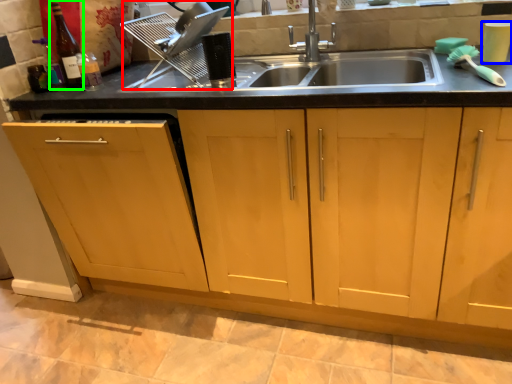
Question: Which object is the farthest from appliance (highlighted by a red box)? Choose among these: appliance (highlighted by a blue box) or bottle (highlighted by a green box).

Choices:
 (A) appliance
 (B) bottle

Answer: (A)